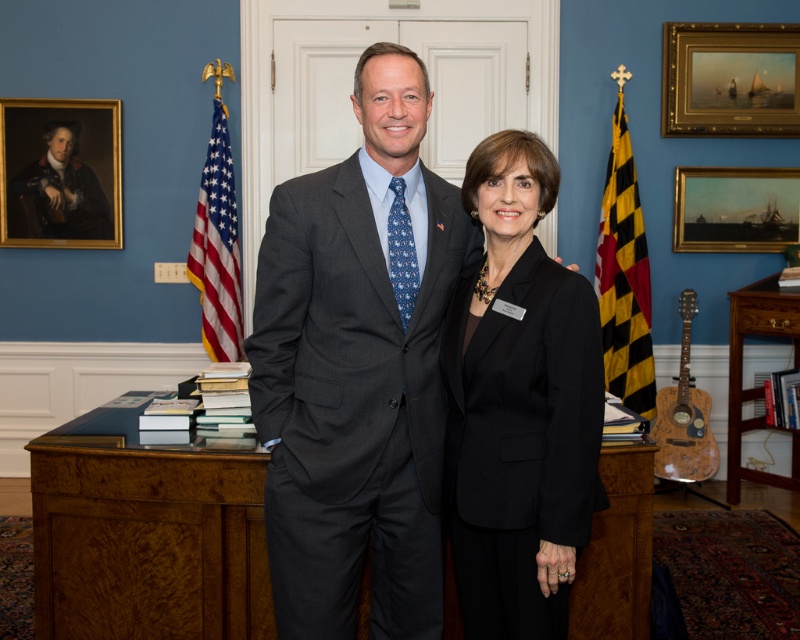
Does black matte blazer at center appear on the right side of goldwooden frame at upper right?

No, black matte blazer at center is not to the right of goldwooden frame at upper right.

Can you confirm if black matte blazer at center is shorter than goldwooden frame at upper right?

No, black matte blazer at center is not shorter than goldwooden frame at upper right.

Does point (454, 330) come closer to viewer compared to point (784, 44)?

Yes, point (454, 330) is in front of point (784, 44).

Locate an element on the screen. This screenshot has width=800, height=640. black matte blazer at center is located at coordinates (518, 404).

Can you confirm if gold-framed portrait at upper left is bigger than yellow/black checkered flag at right?

No, gold-framed portrait at upper left is not bigger than yellow/black checkered flag at right.

Does point (32, 228) come closer to viewer compared to point (606, 232)?

That is False.

This screenshot has width=800, height=640. Describe the element at coordinates (60, 172) in the screenshot. I see `gold-framed portrait at upper left` at that location.

What are the coordinates of `gold-framed portrait at upper left` in the screenshot? It's located at (60, 172).

Who is positioned more to the right, black matte blazer at center or gold-framed painting at upper right?

Positioned to the right is gold-framed painting at upper right.

This screenshot has width=800, height=640. What do you see at coordinates (518, 404) in the screenshot?
I see `black matte blazer at center` at bounding box center [518, 404].

Where is `black matte blazer at center`? This screenshot has width=800, height=640. black matte blazer at center is located at coordinates (518, 404).